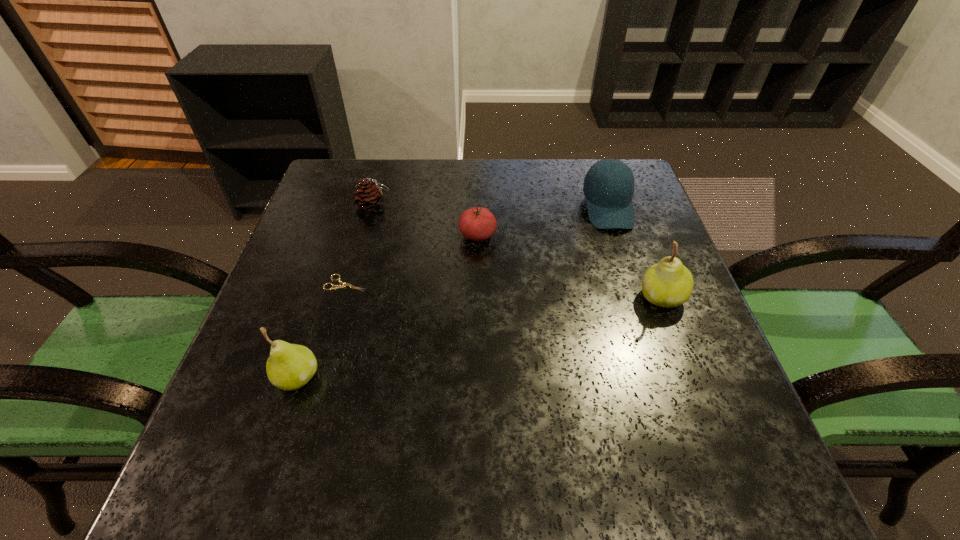
Image resolution: width=960 pixels, height=540 pixels. Find the location of `blank region between the tomato and the nearer pear`. blank region between the tomato and the nearer pear is located at coordinates (387, 307).

I want to click on unoccupied area between the tomato and the nearest object, so 387,307.

Where is `object identified as the closest to the baseball cap`? The width and height of the screenshot is (960, 540). object identified as the closest to the baseball cap is located at coordinates (669, 283).

Image resolution: width=960 pixels, height=540 pixels. Find the location of `the fifth closest object to the pinecone`. the fifth closest object to the pinecone is located at coordinates (669, 283).

You are a GUI agent. You are given a task and a screenshot of the screen. Output one action in this format:
    pyautogui.click(x=<x>, y=<y>)
    Task: Click on the free space that satisfies the following two spatial constraints: 1. with a leaf charm attached to the farther pear; 2. on the left side of the pinecone
    This screenshot has width=960, height=540.
    Given the screenshot: What is the action you would take?
    (348, 297)

At what (x,y) coordinates should I click in order to perform the action: click on free location that satisfies the following two spatial constraints: 1. on the front-facing side of the tallest object; 2. on the left side of the baseball cap. Please return your answer as a coordinate pair (x, y). Looking at the image, I should click on click(x=637, y=297).

Identify the location of blank space that satisfies the following two spatial constraints: 1. on the front-facing side of the tallest object; 2. on the left side of the fourth shortest object. (637, 297).

In order to click on vacant point that satisfies the following two spatial constraints: 1. on the back side of the taller pear; 2. with a leaf charm attached to the pinecone in this screenshot , I will do `click(627, 206)`.